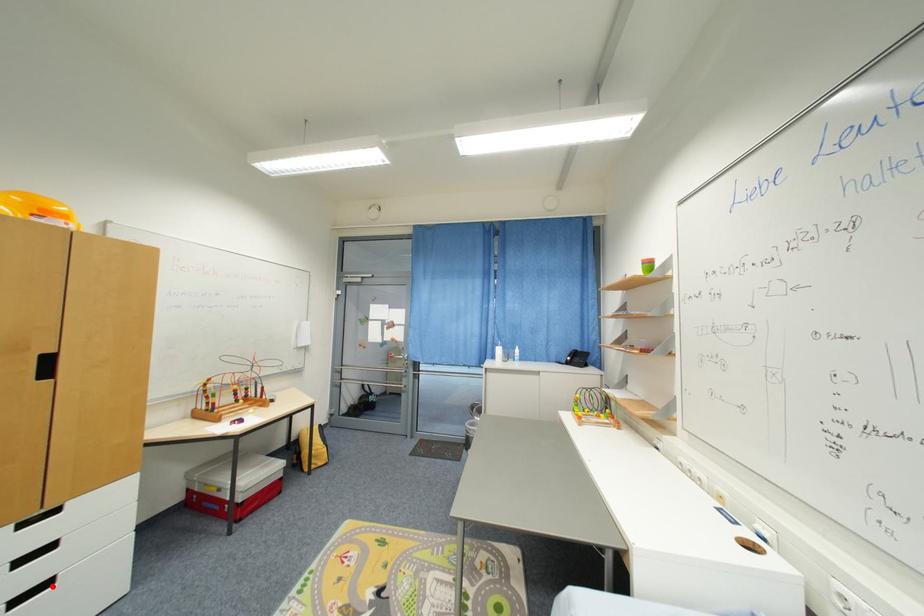
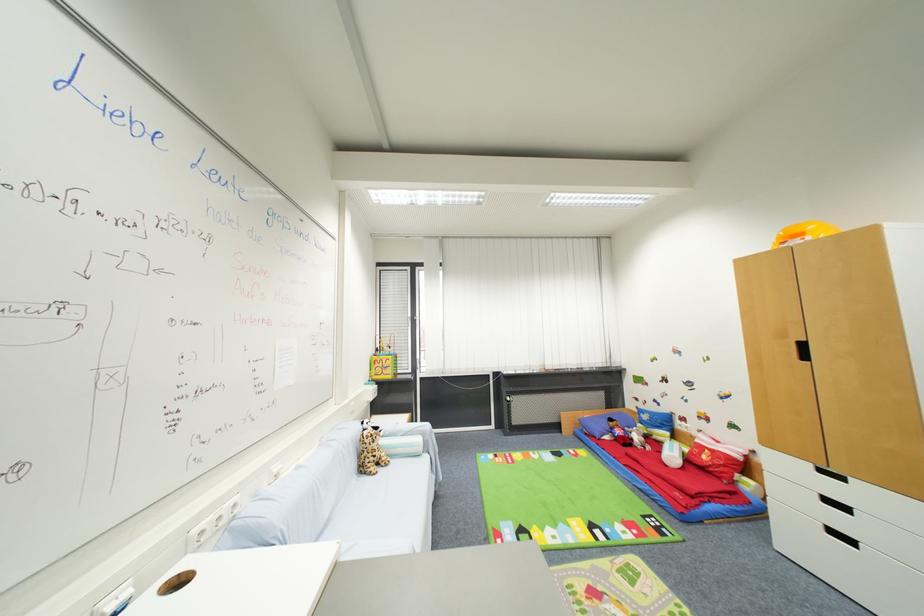
The point at the highlighted location is marked in the first image. Where is the corresponding point in the second image?

(857, 544)